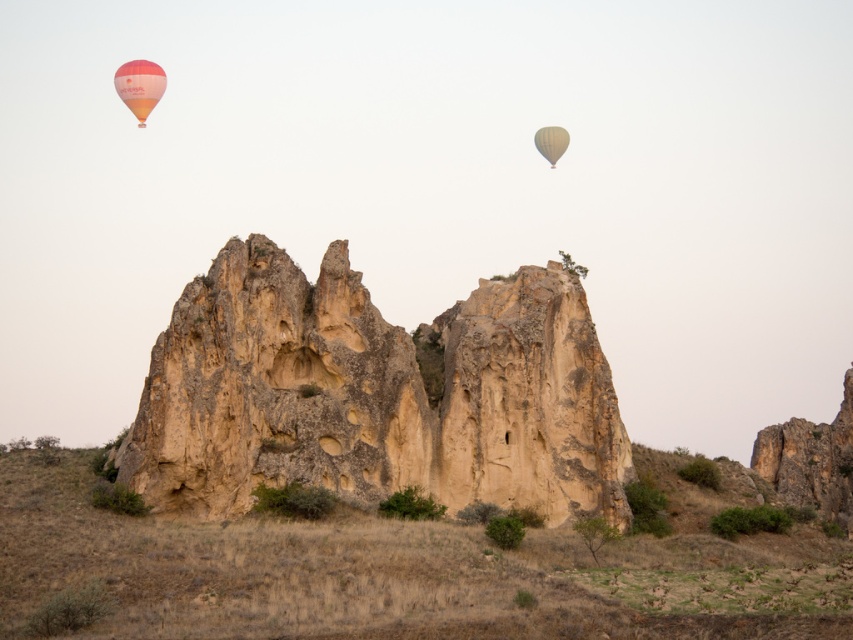
You are an observer standing at the base of the rock formations. You see the matte orange balloon at upper left and the matte yellow balloon at upper right in the sky. Which balloon appears taller when viewed from your position?

The matte orange balloon at upper left appears taller because it has a greater height compared to the matte yellow balloon at upper right.

You are standing at the viewpoint of the image and want to reach the point marked as point (149,72). If your walking speed is 1.5 meters per second, how many seconds will it take you to reach that point?

The distance between you and point (149,72) is 129.94 meters. At a speed of 1.5 meters per second, it will take approximately 86.63 seconds to reach the point.

You are a photographer planning to capture a photo of the matte orange balloon at upper left and the matte yellow balloon at upper right. Based on their positions, which balloon should you focus on first if you want to include both in your shot without moving the camera?

The matte orange balloon at upper left should be focused on first since it is positioned on the left side of the matte yellow balloon at upper right, allowing both to be captured in the frame without needing to reposition the camera.